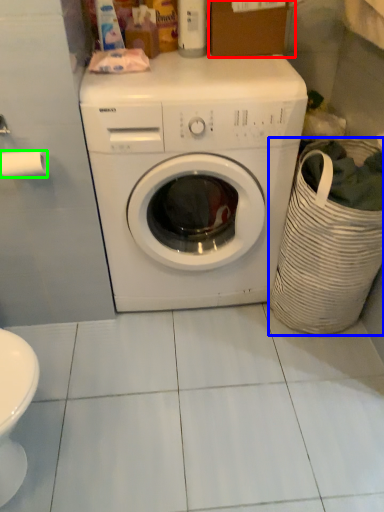
Question: Estimate the real-world distances between objects in this image. Which object is closer to cardboard box (highlighted by a red box), laundry basket (highlighted by a blue box) or toilet paper (highlighted by a green box)?

Choices:
 (A) laundry basket
 (B) toilet paper

Answer: (A)